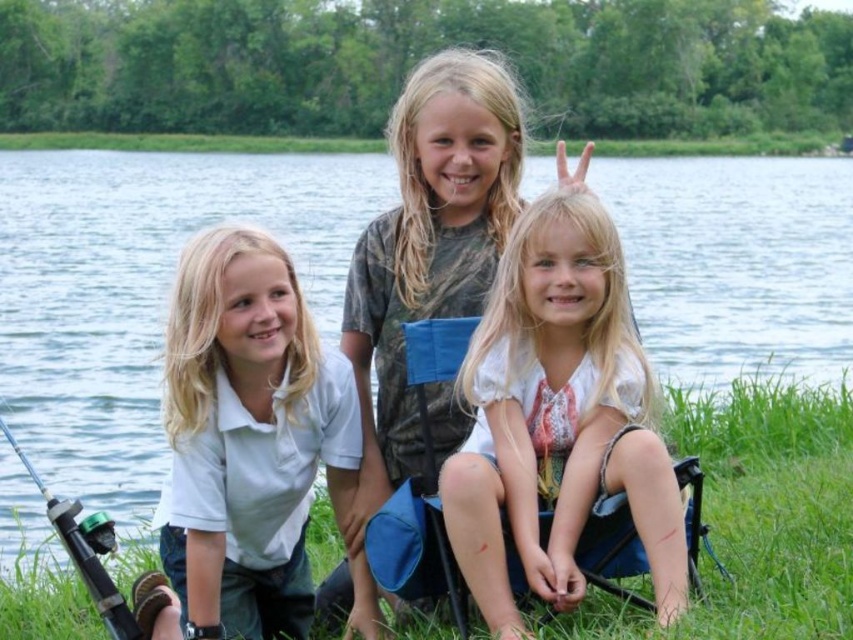
You are a photographer trying to capture the scene with the white cotton shirt at left and the green grass at lower center. Based on their positions, which object should you focus on first if you want to include both in your shot without moving the camera?

The white cotton shirt at left is to the left of the green grass at lower center, so you should focus on the white cotton shirt at left first to ensure both are in frame.

You are a photographer trying to capture a photo of the clear blue water at center and the white cotton shirt at left. Based on their positions, which object is higher in the image?

The clear blue water at center is much taller than the white cotton shirt at left, so the clear blue water at center is higher in the image.